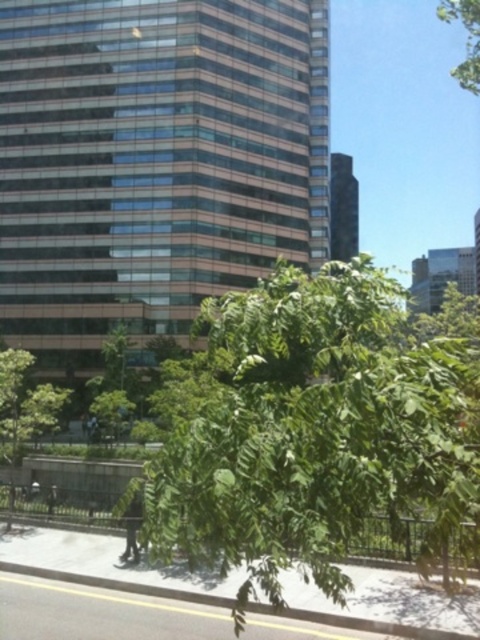
You are a photographer planning to take a picture of the glassy brown building at center. However, there is a green leafy tree at center in the way. Can you still see the building through the tree?

The green leafy tree at center is behind the glassy brown building at center, so yes, you can see the building through the tree because the tree is positioned behind it.

You are a city planner assessing the urban space. You need to determine if the green leafy tree at center can be fully visible from the main walkway without obstruction from the glassy brown building at center. Based on their sizes, can the tree be seen in full from the walkway?

The glassy brown building at center is bigger than the green leafy tree at center. Since the building is larger, it may partially block the view of the tree from the walkway, but the tree is smaller and positioned at the center, so parts of it might still be visible. However, the question specifies full visibility. The building being bigger could mean it extends more around the tree, potentially obstructing some parts. Without exact positioning details, but based on size alone, the tree might not be fully 1

You are a city planner evaluating the urban space. Given the glassy brown building at center and the green leafy tree at center, which one has a greater width?

The glassy brown building at center has a greater width than the green leafy tree at center.